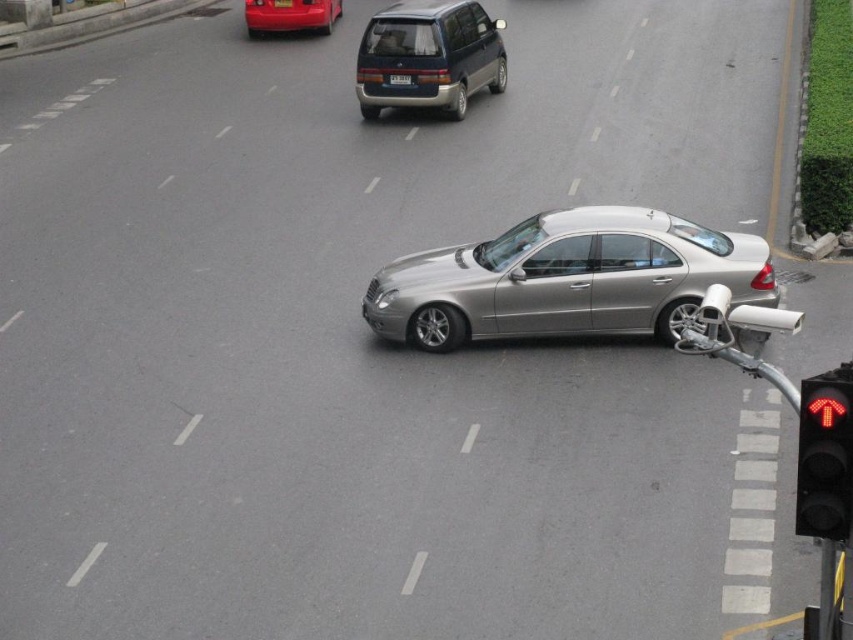
Question: Can you confirm if red glass traffic light at lower right is smaller than black plastic license plate at center?

Choices:
 (A) no
 (B) yes

Answer: (A)

Question: Based on their relative distances, which object is nearer to the red glass traffic light at lower right?

Choices:
 (A) shiny red car at upper center
 (B) white plastic license plate at center
 (C) black plastic license plate at center
 (D) satin silver car at center

Answer: (D)

Question: Is satin silver car at center wider than blue metallic minivan at center?

Choices:
 (A) no
 (B) yes

Answer: (B)

Question: Which of the following is the closest to the observer?

Choices:
 (A) white plastic license plate at center
 (B) shiny red car at upper center
 (C) blue metallic minivan at center

Answer: (C)

Question: Which of the following is the farthest from the observer?

Choices:
 (A) blue metallic minivan at center
 (B) white plastic license plate at center
 (C) red glass traffic light at lower right

Answer: (B)

Question: In this image, where is shiny red car at upper center located relative to white plastic license plate at center?

Choices:
 (A) above
 (B) below

Answer: (A)